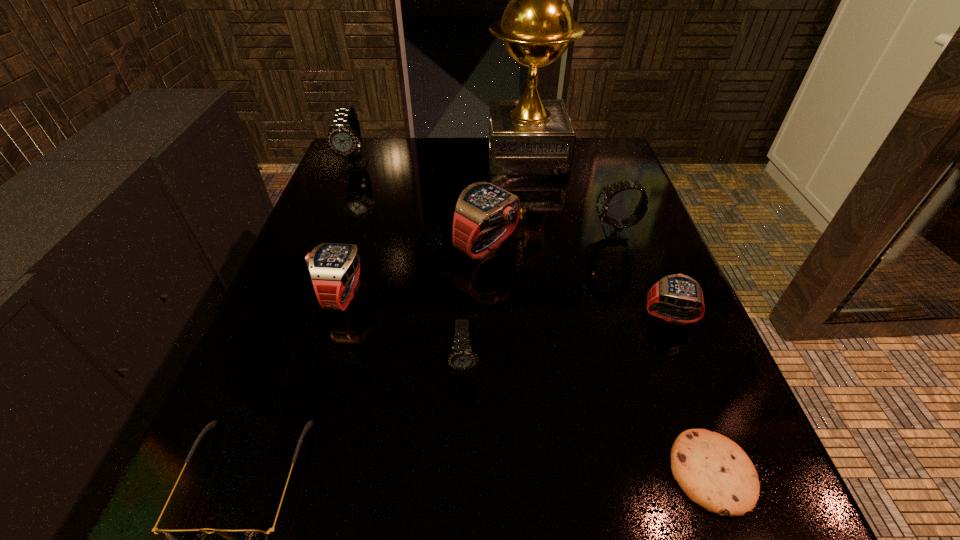
Where is `vacant region at the far right corner`? Image resolution: width=960 pixels, height=540 pixels. vacant region at the far right corner is located at coordinates (590, 184).

Locate an element on the screen. vacant space at the near right corner of the desktop is located at coordinates 729,516.

This screenshot has width=960, height=540. Identify the location of vacant space that's between the second tallest object and the third nearest object. pyautogui.click(x=410, y=266).

This screenshot has height=540, width=960. Find the location of `empty space that is in between the biggest red watch and the third nearest object`. empty space that is in between the biggest red watch and the third nearest object is located at coordinates (475, 306).

This screenshot has height=540, width=960. Identify the location of free spot between the second smallest red watch and the second gray watch from right to left. (403, 330).

You are a GUI agent. You are given a task and a screenshot of the screen. Output one action in this format:
    pyautogui.click(x=<x>, y=<y>)
    Task: Click on the unoccupied position between the second smallest gray watch and the cookie
    
    Given the screenshot: What is the action you would take?
    pyautogui.click(x=663, y=353)

I want to click on vacant area that lies between the shortest watch and the tallest watch, so click(x=513, y=240).

Locate an element on the screen. free area in between the award and the leftmost gray watch is located at coordinates (442, 160).

Point out which object is positioned as the eighth nearest to the shortest object. Please provide its 2D coordinates. Your answer should be formatted as a tuple, i.e. [(x, y)], where the tuple contains the x and y coordinates of a point satisfying the conditions above.

[(344, 137)]

Where is `object that is the fourth closest one to the nearest gray watch`? Image resolution: width=960 pixels, height=540 pixels. object that is the fourth closest one to the nearest gray watch is located at coordinates (714, 472).